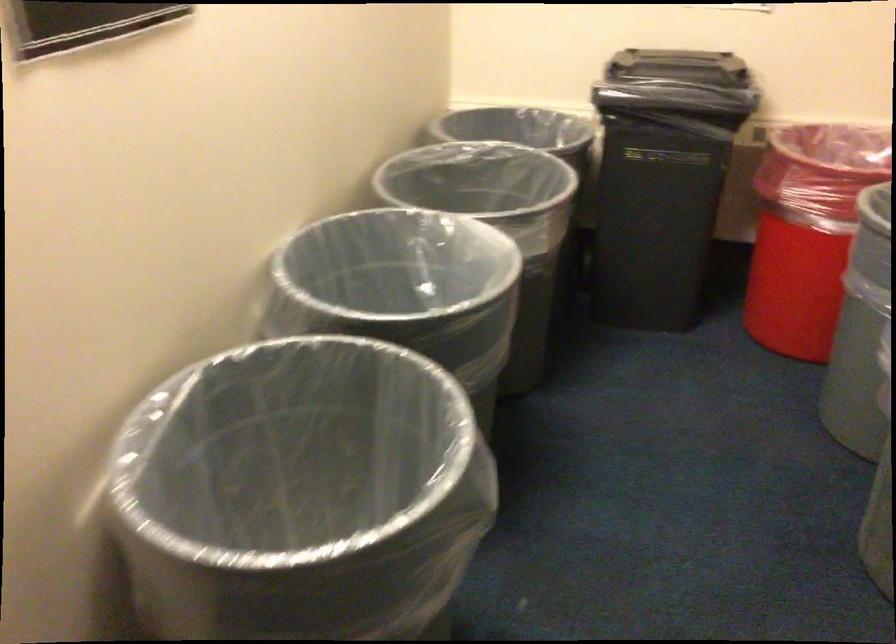
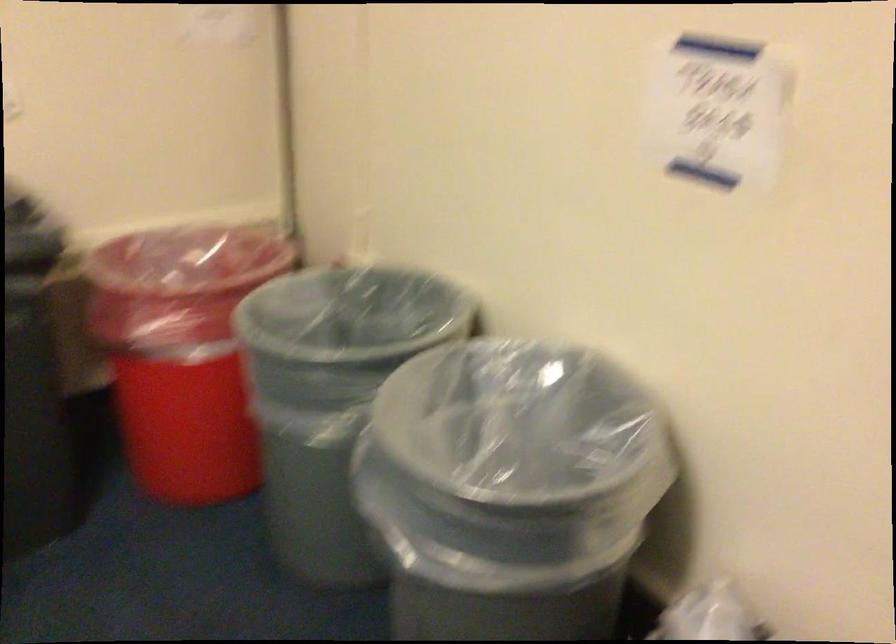
Question: Based on the continuous images, in which direction is the camera rotating? Reply with the corresponding letter.

Choices:
 (A) Left
 (B) Right
 (C) Up
 (D) Down

Answer: (B)